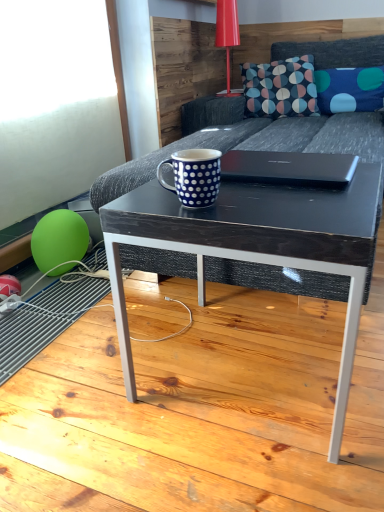
Where is `dark blue fabric pillow with colorful circles at upper center`? This screenshot has width=384, height=512. dark blue fabric pillow with colorful circles at upper center is located at coordinates (280, 88).

The width and height of the screenshot is (384, 512). Describe the element at coordinates (289, 168) in the screenshot. I see `black matte laptop at center` at that location.

What do you see at coordinates (194, 176) in the screenshot?
I see `blue dotted mug at center` at bounding box center [194, 176].

Locate an element on the screen. This screenshot has width=384, height=512. blue dotted mug at center is located at coordinates (194, 176).

I want to click on green rubber balloon at lower left, so click(59, 239).

Where is `dark wood/black textured coffee table at center`? dark wood/black textured coffee table at center is located at coordinates (254, 246).

The image size is (384, 512). I want to click on dark blue fabric pillow with colorful circles at upper center, so tap(280, 88).

In the scene shown: What's the angular difference between glossy plastic table lamp at upper center and blue dotted fabric pillow at upper right's facing directions?

The angular difference between glossy plastic table lamp at upper center and blue dotted fabric pillow at upper right is 90.2 degrees.

Does glossy plastic table lamp at upper center contain blue dotted fabric pillow at upper right?

No, blue dotted fabric pillow at upper right is not a part of glossy plastic table lamp at upper center.

Is blue dotted fabric pillow at upper right at the back of glossy plastic table lamp at upper center?

glossy plastic table lamp at upper center does not have its back to blue dotted fabric pillow at upper right.

Can you confirm if glossy plastic table lamp at upper center is shorter than blue dotted fabric pillow at upper right?

No.

Is dark gray fabric couch at center far from green rubber balloon at lower left?

No, dark gray fabric couch at center is not far from green rubber balloon at lower left.

Consider the image. Which is correct: dark gray fabric couch at center is inside green rubber balloon at lower left, or outside of it?

dark gray fabric couch at center is not enclosed by green rubber balloon at lower left.

From the image's perspective, between dark gray fabric couch at center and green rubber balloon at lower left, which one is located above?

dark gray fabric couch at center is shown above in the image.

Based on their sizes in the image, would you say dark gray fabric couch at center is bigger or smaller than green rubber balloon at lower left?

Clearly, dark gray fabric couch at center is larger in size than green rubber balloon at lower left.

How distant is dark blue fabric pillow with colorful circles at upper center from blue dotted mug at center?

A distance of 1.89 meters exists between dark blue fabric pillow with colorful circles at upper center and blue dotted mug at center.

Looking at this image, considering the sizes of dark blue fabric pillow with colorful circles at upper center and blue dotted mug at center in the image, is dark blue fabric pillow with colorful circles at upper center wider or thinner than blue dotted mug at center?

Clearly, dark blue fabric pillow with colorful circles at upper center has more width compared to blue dotted mug at center.

From a real-world perspective, is dark blue fabric pillow with colorful circles at upper center on top of blue dotted mug at center?

Yes, from a real-world perspective, dark blue fabric pillow with colorful circles at upper center is over blue dotted mug at center

In terms of height, does dark blue fabric pillow with colorful circles at upper center look taller or shorter compared to blue dotted mug at center?

Clearly, dark blue fabric pillow with colorful circles at upper center is taller compared to blue dotted mug at center.

In the scene shown: Is blue dotted fabric pillow at upper right placed right next to blue dotted mug at center?

blue dotted fabric pillow at upper right is not next to blue dotted mug at center, and they're not touching.

Which object is wider, blue dotted fabric pillow at upper right or blue dotted mug at center?

blue dotted fabric pillow at upper right is wider.

Which point is more distant from viewer, (x=365, y=90) or (x=208, y=153)?

Positioned behind is point (x=365, y=90).

Is blue dotted fabric pillow at upper right bigger than blue dotted mug at center?

Yes.

Is green rubber balloon at lower left inside or outside of black matte laptop at center?

The correct answer is: outside.

Looking at this image, are green rubber balloon at lower left and black matte laptop at center far apart?

Actually, green rubber balloon at lower left and black matte laptop at center are a little close together.

From a real-world perspective, is green rubber balloon at lower left positioned above or below black matte laptop at center?

green rubber balloon at lower left is below black matte laptop at center.

Could you tell me if green rubber balloon at lower left is turned towards black matte laptop at center?

Yes.

Is green rubber balloon at lower left positioned with its back to blue dotted fabric pillow at upper right?

No, green rubber balloon at lower left's orientation is not away from blue dotted fabric pillow at upper right.

Is green rubber balloon at lower left not near blue dotted fabric pillow at upper right?

Yes.

Between green rubber balloon at lower left and blue dotted fabric pillow at upper right, which one is positioned in front?

green rubber balloon at lower left is in front.

Can we say green rubber balloon at lower left lies outside blue dotted fabric pillow at upper right?

green rubber balloon at lower left lies outside blue dotted fabric pillow at upper right's area.

Would you say dark wood/black textured coffee table at center is to the left or to the right of black matte laptop at center in the picture?

Clearly, dark wood/black textured coffee table at center is on the left of black matte laptop at center in the image.

Is dark wood/black textured coffee table at center oriented away from black matte laptop at center?

That's not correct — dark wood/black textured coffee table at center is not looking away from black matte laptop at center.

How distant is dark wood/black textured coffee table at center from black matte laptop at center?

The distance of dark wood/black textured coffee table at center from black matte laptop at center is 6.50 inches.

Can you confirm if dark wood/black textured coffee table at center is smaller than black matte laptop at center?

Incorrect, dark wood/black textured coffee table at center is not smaller in size than black matte laptop at center.

Identify the location of pillow that appears behind the glossy plastic table lamp at upper center. This screenshot has height=512, width=384. (350, 89).

The image size is (384, 512). In order to click on studio couch lying in front of the green rubber balloon at lower left in this screenshot , I will do `click(251, 142)`.

From the image, which object appears to be nearer to green rubber balloon at lower left, dark blue fabric pillow with colorful circles at upper center or dark wood/black textured coffee table at center?

dark wood/black textured coffee table at center lies closer to green rubber balloon at lower left than the other object.

Estimate the real-world distances between objects in this image. Which object is closer to dark wood/black textured coffee table at center, black matte laptop at center or dark gray fabric couch at center?

black matte laptop at center is positioned closer to the anchor dark wood/black textured coffee table at center.

Considering their positions, is dark gray fabric couch at center positioned closer to blue dotted mug at center than dark wood/black textured coffee table at center?

dark wood/black textured coffee table at center is closer to blue dotted mug at center.

From the picture: When comparing their distances from blue dotted mug at center, does blue dotted fabric pillow at upper right or green rubber balloon at lower left seem closer?

green rubber balloon at lower left.

From the image, which object appears to be nearer to glossy plastic table lamp at upper center, dark blue fabric pillow with colorful circles at upper center or blue dotted fabric pillow at upper right?

Based on the image, dark blue fabric pillow with colorful circles at upper center appears to be nearer to glossy plastic table lamp at upper center.

From the picture: Based on their spatial positions, is glossy plastic table lamp at upper center or green rubber balloon at lower left further from blue dotted fabric pillow at upper right?

green rubber balloon at lower left.

Looking at the image, which one is located further to glossy plastic table lamp at upper center, dark gray fabric couch at center or blue dotted fabric pillow at upper right?

dark gray fabric couch at center is further to glossy plastic table lamp at upper center.

Considering their positions, is green rubber balloon at lower left positioned further to blue dotted mug at center than blue dotted fabric pillow at upper right?

blue dotted fabric pillow at upper right is positioned further to the anchor blue dotted mug at center.

I want to click on table lamp between dark wood/black textured coffee table at center and blue dotted fabric pillow at upper right from front to back, so click(x=227, y=34).

At what (x,y) coordinates should I click in order to perform the action: click on laptop between dark gray fabric couch at center and dark wood/black textured coffee table at center from top to bottom. Please return your answer as a coordinate pair (x, y). Looking at the image, I should click on (289, 168).

In order to click on studio couch between blue dotted mug at center and blue dotted fabric pillow at upper right from front to back in this screenshot , I will do `click(251, 142)`.

Find the location of `throw pillow between glossy plastic table lamp at upper center and green rubber balloon at lower left from top to bottom`. throw pillow between glossy plastic table lamp at upper center and green rubber balloon at lower left from top to bottom is located at coordinates (280, 88).